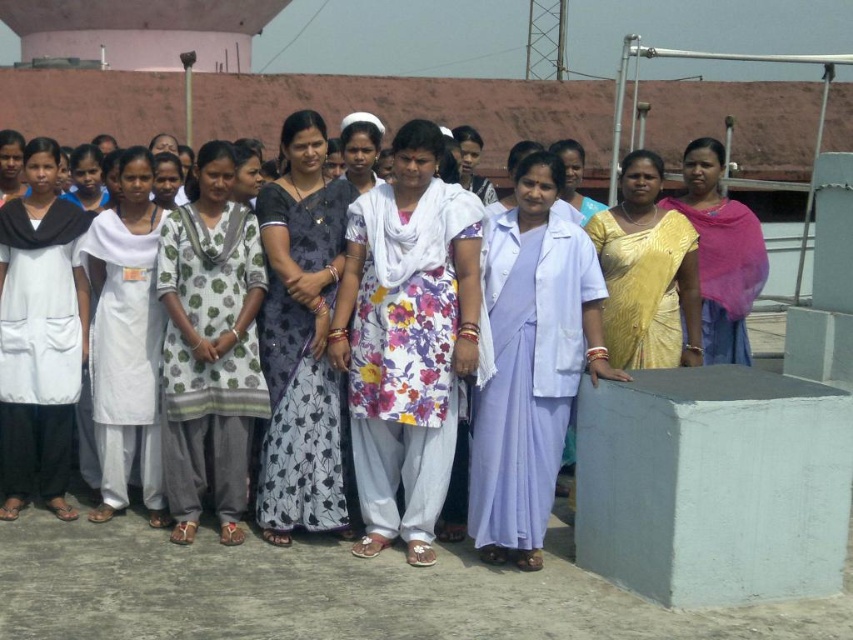
Question: Which object is farther from the camera taking this photo?

Choices:
 (A) white cotton kurta at center
 (B) floral cotton kurta at center
 (C) floral fabric dress at center

Answer: (A)

Question: Can you confirm if dark blue floral saree at center is positioned above white cotton kurta at center?

Choices:
 (A) no
 (B) yes

Answer: (B)

Question: Which point is closer to the camera?

Choices:
 (A) white cotton dress at center
 (B) gold shimmering saree at center

Answer: (B)

Question: Considering the real-world distances, which object is closest to the floral cotton kurta at center?

Choices:
 (A) white cotton dress at center
 (B) light purple silk saree at center
 (C) yellow satin saree at center
 (D) gold shimmering saree at center

Answer: (A)

Question: Can you confirm if white cotton kurta at center is thinner than yellow satin saree at center?

Choices:
 (A) no
 (B) yes

Answer: (B)

Question: Can you confirm if floral cotton kurta at center is smaller than white cotton dress at center?

Choices:
 (A) no
 (B) yes

Answer: (A)